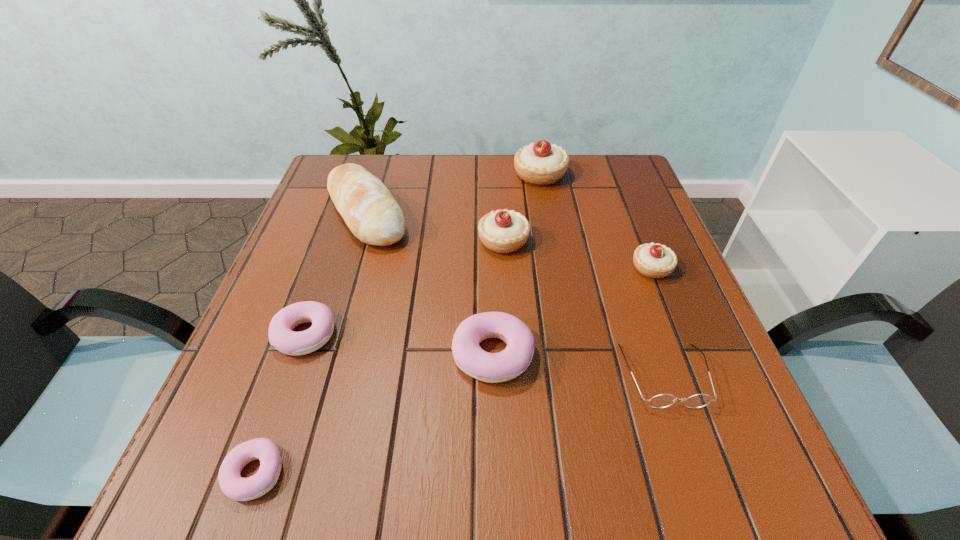
Locate an element on the screen. The height and width of the screenshot is (540, 960). vacant area at the near edge is located at coordinates (405, 465).

Find the location of a particular element. This screenshot has width=960, height=540. vacant space at the left edge of the desktop is located at coordinates (328, 222).

Locate an element on the screen. Image resolution: width=960 pixels, height=540 pixels. vacant space at the right edge is located at coordinates (737, 422).

Find the location of a particular element. free space at the far right corner of the desktop is located at coordinates (627, 190).

This screenshot has width=960, height=540. I want to click on free space at the near right corner of the desktop, so click(x=686, y=469).

Locate an element on the screen. The height and width of the screenshot is (540, 960). blank region between the bread and the second biggest beige pastry is located at coordinates (435, 227).

Identify the location of vacant space that's between the shortest object and the fifth shortest pastry. (379, 357).

The image size is (960, 540). I want to click on free space between the shortest pastry and the farthest pastry, so click(x=397, y=324).

The width and height of the screenshot is (960, 540). In order to click on vacant region between the fourth tallest object and the smallest pink pastry in this screenshot , I will do `click(453, 370)`.

This screenshot has height=540, width=960. I want to click on vacant area between the dark spectacles and the smallest beige pastry, so click(x=659, y=322).